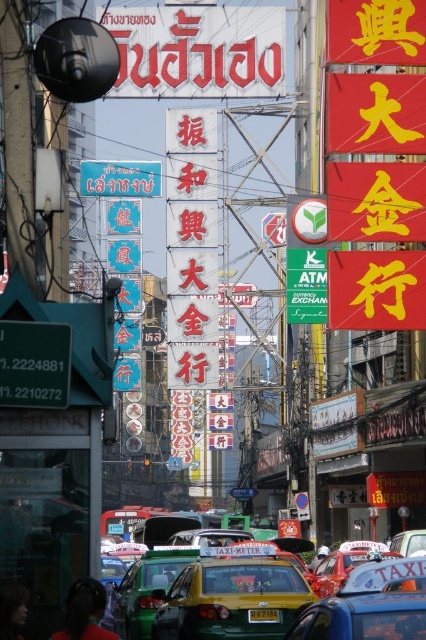
Question: Does yellow-green plastic taxi at center have a lesser width compared to dark blue fabric at lower left?

Choices:
 (A) yes
 (B) no

Answer: (B)

Question: Is yellow-green plastic taxi at center thinner than dark blue fabric at lower left?

Choices:
 (A) no
 (B) yes

Answer: (A)

Question: Which object appears farthest from the camera in this image?

Choices:
 (A) metallic blue taxi at center
 (B) red matte sign at upper center
 (C) dark blue fabric at lower left

Answer: (B)

Question: Based on their relative distances, which object is nearer to the yellow-green plastic taxi at center?

Choices:
 (A) red matte sign at upper center
 (B) red/yellow sign at center

Answer: (B)

Question: Considering the real-world distances, which object is farthest from the metallic blue taxi at center?

Choices:
 (A) red matte sign at upper center
 (B) yellow-green plastic taxi at center
 (C) yellow metallic taxi at center
 (D) dark blue fabric at lower left

Answer: (A)

Question: Does red/yellow sign at center lie in front of yellow metallic taxi at center?

Choices:
 (A) no
 (B) yes

Answer: (A)